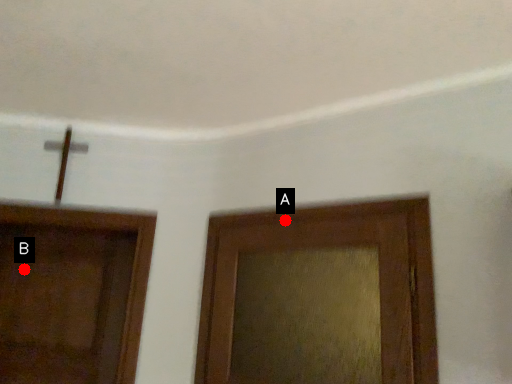
Question: Two points are circled on the image, labeled by A and B beside each circle. Which of the following is the farthest from the observer?

Choices:
 (A) A is further
 (B) B is further

Answer: (B)